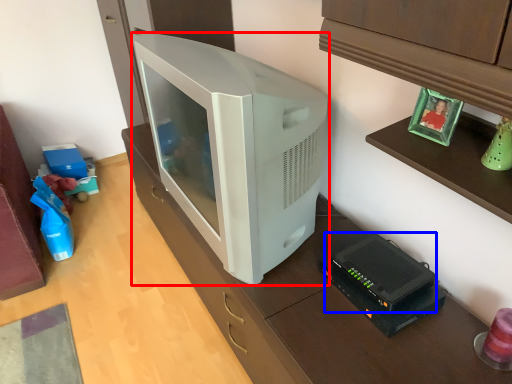
Question: Which object is further to the camera taking this photo, television (highlighted by a red box) or appliance (highlighted by a blue box)?

Choices:
 (A) television
 (B) appliance

Answer: (B)